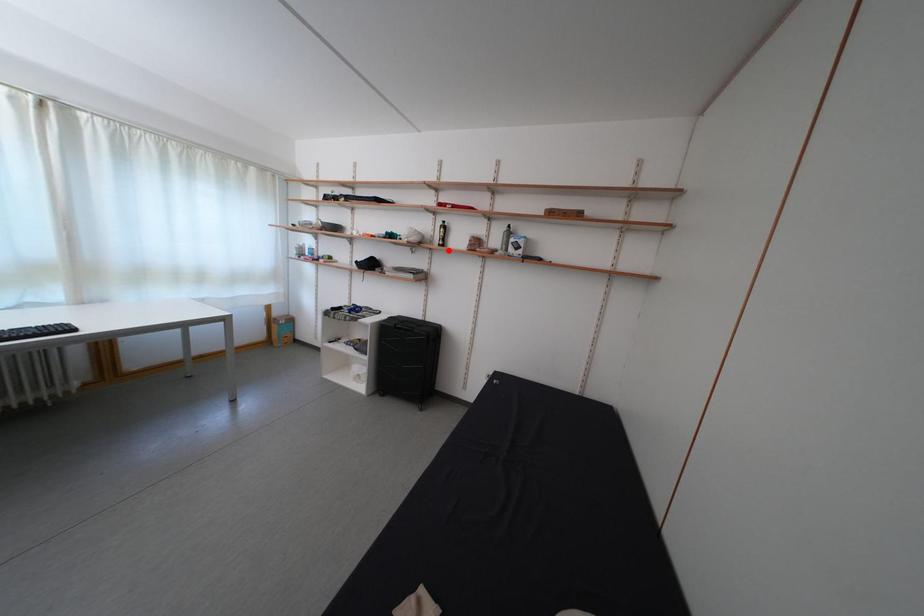
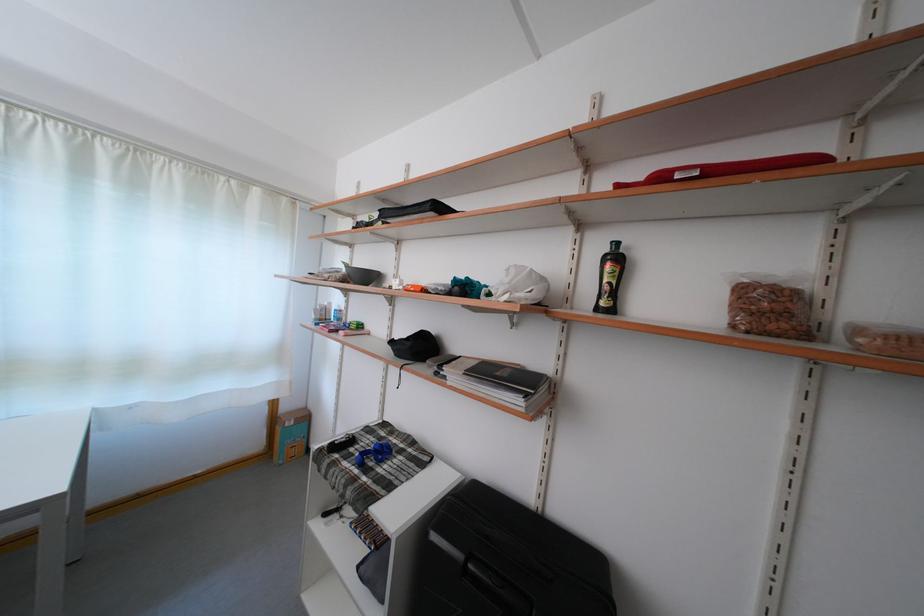
The point at the highlighted location is marked in the first image. Where is the corresponding point in the second image?

(606, 314)